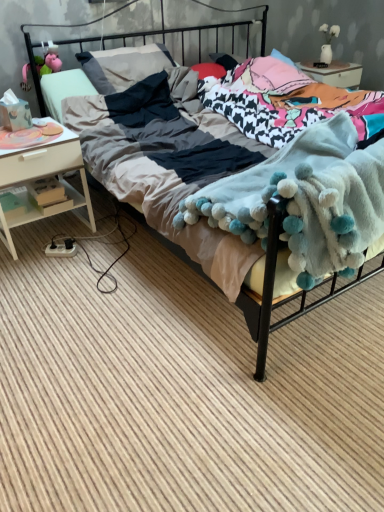
Question: Is soft cotton bed at center shorter than fluffy white blanket at center?

Choices:
 (A) yes
 (B) no

Answer: (B)

Question: From the image's perspective, is soft cotton bed at center located above fluffy white blanket at center?

Choices:
 (A) yes
 (B) no

Answer: (A)

Question: Is soft cotton bed at center positioned in front of fluffy white blanket at center?

Choices:
 (A) no
 (B) yes

Answer: (B)

Question: Is soft cotton bed at center wider than fluffy white blanket at center?

Choices:
 (A) no
 (B) yes

Answer: (B)

Question: Is soft cotton bed at center to the left of fluffy white blanket at center from the viewer's perspective?

Choices:
 (A) no
 (B) yes

Answer: (B)

Question: Would you say wooden boxes at left is to the left or to the right of white wood nightstand at left in the picture?

Choices:
 (A) left
 (B) right

Answer: (B)

Question: Considering the positions of point (77, 202) and point (77, 211), is point (77, 202) closer or farther from the camera than point (77, 211)?

Choices:
 (A) closer
 (B) farther

Answer: (A)

Question: From the image's perspective, is wooden boxes at left above or below white wood nightstand at left?

Choices:
 (A) above
 (B) below

Answer: (B)

Question: Considering their positions, is wooden boxes at left located in front of or behind white wood nightstand at left?

Choices:
 (A) behind
 (B) front

Answer: (A)

Question: Is fluffy white blanket at center in front of or behind white wood nightstand at left in the image?

Choices:
 (A) front
 (B) behind

Answer: (A)

Question: Is fluffy white blanket at center bigger or smaller than white wood nightstand at left?

Choices:
 (A) big
 (B) small

Answer: (A)

Question: Considering the positions of point (350, 181) and point (77, 166), is point (350, 181) closer or farther from the camera than point (77, 166)?

Choices:
 (A) closer
 (B) farther

Answer: (A)

Question: In the image, is fluffy white blanket at center on the left side or the right side of white wood nightstand at left?

Choices:
 (A) right
 (B) left

Answer: (A)

Question: Visually, is white wood nightstand at left positioned to the left or to the right of wooden boxes at left?

Choices:
 (A) left
 (B) right

Answer: (A)

Question: From their relative heights in the image, would you say white wood nightstand at left is taller or shorter than wooden boxes at left?

Choices:
 (A) tall
 (B) short

Answer: (A)